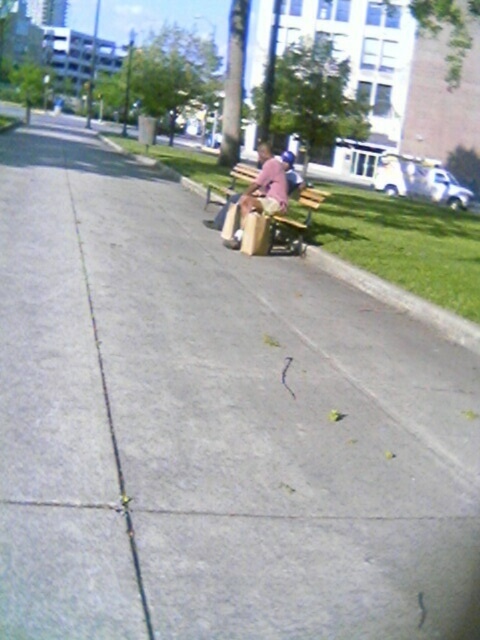
Question: Can you confirm if pink fabric shirt at center is thinner than wooden park bench at center?

Choices:
 (A) no
 (B) yes

Answer: (A)

Question: Which object is farther from the camera taking this photo?

Choices:
 (A) wooden park bench at center
 (B) wooden bench at center
 (C) green grass at lower right
 (D) pink fabric shirt at center

Answer: (A)

Question: Which point is closer to the camera?

Choices:
 (A) wooden park bench at center
 (B) wooden bench at center

Answer: (B)

Question: Can you confirm if wooden bench at center is bigger than wooden park bench at center?

Choices:
 (A) no
 (B) yes

Answer: (B)

Question: Which point appears farthest from the camera in this image?

Choices:
 (A) (385, 289)
 (B) (278, 180)
 (C) (300, 241)

Answer: (C)

Question: In this image, where is wooden bench at center located relative to wooden park bench at center?

Choices:
 (A) above
 (B) below

Answer: (B)